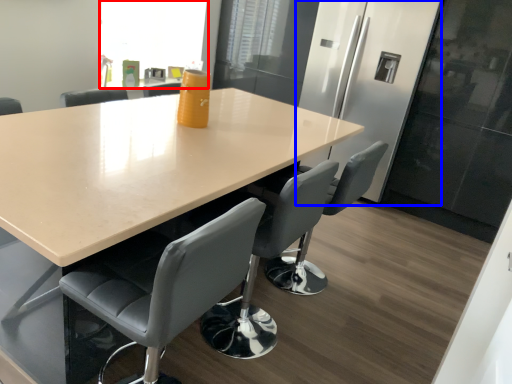
Question: Which of the following is the farthest to the observer, window screen (highlighted by a red box) or fridge (highlighted by a blue box)?

Choices:
 (A) window screen
 (B) fridge

Answer: (A)